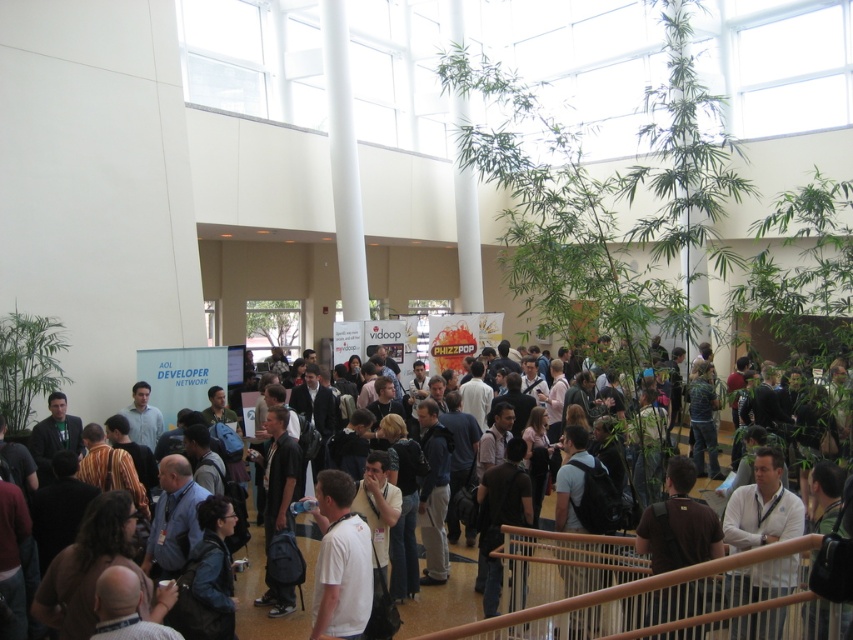
You are at the event and want to greet the person wearing the dark blue shirt at center. However, there is a brown fabric backpack at lower center in your way. Can you walk around the backpack to reach the person?

The dark blue shirt at center is positioned under the brown fabric backpack at lower center, meaning the backpack is closer to you. You can walk around the brown fabric backpack at lower center to reach the person wearing the dark blue shirt at center since the backpack is in front of them but not blocking all paths.

Consider the image. You are standing at the entrance of the event space and see a person wearing a white matte shirt at lower right. If you want to approach them, in which direction should you move relative to your current position?

The white matte shirt at lower right is located at coordinates point (762, 506), so you should move towards the lower right direction to approach them.

From the picture: You are a photographer at the event and want to capture both the white matte shirt at lower right and the white matte shirt at center in a single shot. Which of the two shirts should you focus on to ensure both are in frame without moving the camera?

You should focus on the white matte shirt at center because it is larger in size compared to the white matte shirt at lower right, allowing both to be captured within the frame more effectively.